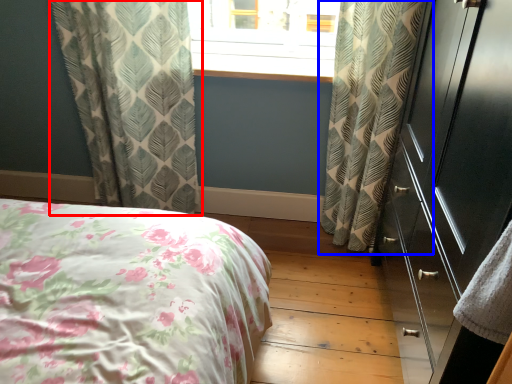
Question: Which point is closer to the camera, curtain (highlighted by a red box) or curtain (highlighted by a blue box)?

Choices:
 (A) curtain
 (B) curtain

Answer: (B)